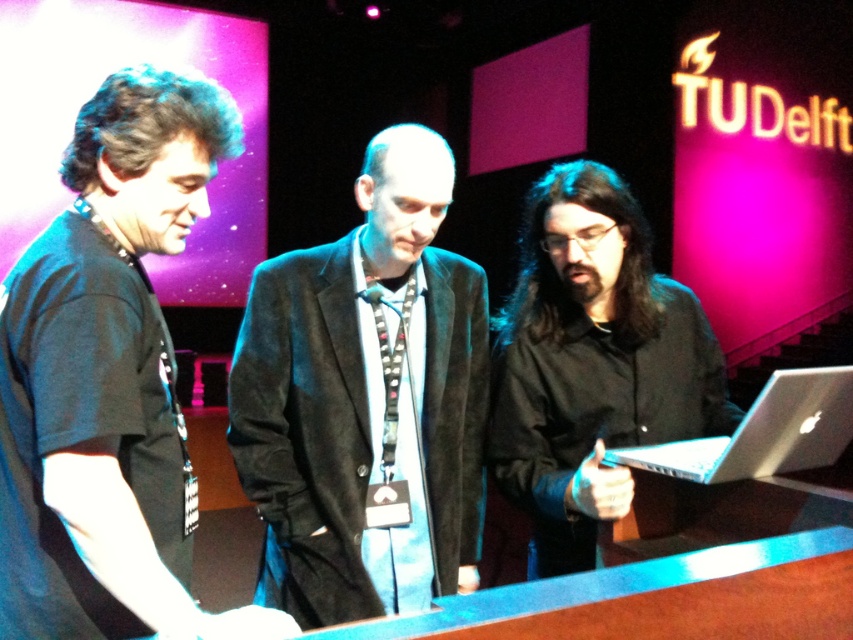
Does black suede jacket at center have a smaller size compared to silver metallic laptop at center?

Actually, black suede jacket at center might be larger than silver metallic laptop at center.

The height and width of the screenshot is (640, 853). I want to click on black suede jacket at center, so click(364, 397).

The width and height of the screenshot is (853, 640). What are the coordinates of `black suede jacket at center` in the screenshot? It's located at point(364,397).

Where is `black matte shirt at center`? The width and height of the screenshot is (853, 640). black matte shirt at center is located at coordinates (592, 362).

Between point (556, 196) and point (790, 396), which one is positioned behind?

Positioned behind is point (556, 196).

The width and height of the screenshot is (853, 640). Describe the element at coordinates (592, 362) in the screenshot. I see `black matte shirt at center` at that location.

The height and width of the screenshot is (640, 853). Find the location of `black matte shirt at center`. black matte shirt at center is located at coordinates (592, 362).

Which of these two, black matte shirt at left or silver metallic laptop at center, stands shorter?

silver metallic laptop at center is shorter.

What do you see at coordinates (109, 380) in the screenshot? This screenshot has height=640, width=853. I see `black matte shirt at left` at bounding box center [109, 380].

Locate an element on the screen. black matte shirt at left is located at coordinates (109, 380).